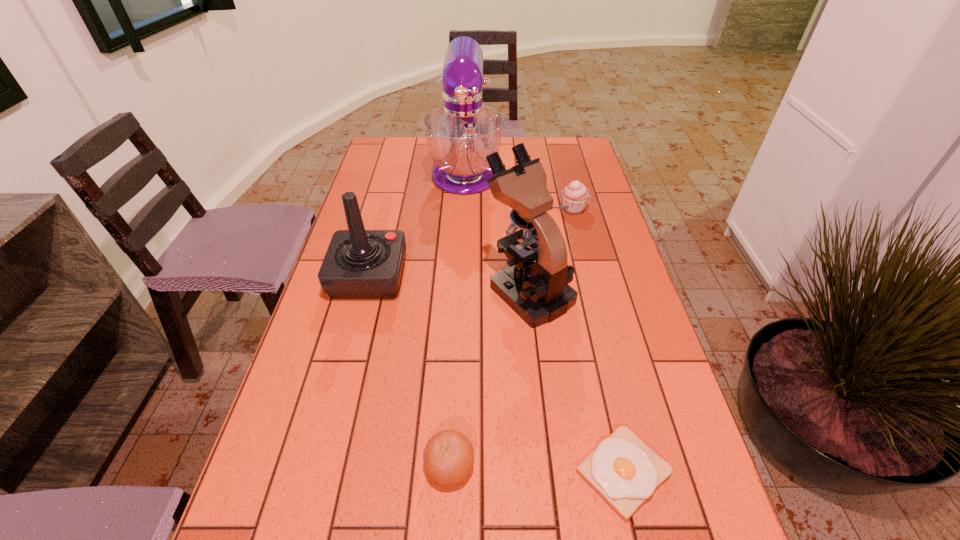
You are a GUI agent. You are given a task and a screenshot of the screen. Output one action in this format:
    pyautogui.click(x=<x>, y=<y>)
    Task: Click on the object that stands as the fourth closest to the leftmost object
    
    Given the screenshot: What is the action you would take?
    pyautogui.click(x=575, y=195)

Where is `free space that satisfies the following two spatial constraints: 1. on the back side of the shortest object; 2. on the front-facing side of the third tallest object`? free space that satisfies the following two spatial constraints: 1. on the back side of the shortest object; 2. on the front-facing side of the third tallest object is located at coordinates (578, 276).

The image size is (960, 540). I want to click on vacant area in the image that satisfies the following two spatial constraints: 1. on the back side of the second shortest object; 2. on the front-facing side of the leftmost object, so click(459, 276).

Locate an element on the screen. Image resolution: width=960 pixels, height=540 pixels. vacant point that satisfies the following two spatial constraints: 1. on the back side of the clementine; 2. on the right side of the cupcake is located at coordinates click(x=463, y=209).

Where is `vacant area in the image that satisfies the following two spatial constraints: 1. on the front side of the third shortest object; 2. on the front-facing side of the joystick`? The image size is (960, 540). vacant area in the image that satisfies the following two spatial constraints: 1. on the front side of the third shortest object; 2. on the front-facing side of the joystick is located at coordinates (590, 276).

Locate an element on the screen. Image resolution: width=960 pixels, height=540 pixels. vacant point that satisfies the following two spatial constraints: 1. at the bowl opening of the mixer; 2. on the left side of the shortest object is located at coordinates (451, 472).

This screenshot has width=960, height=540. I want to click on free space that satisfies the following two spatial constraints: 1. on the back side of the second shortest object; 2. on the right side of the third shortest object, so click(463, 209).

The width and height of the screenshot is (960, 540). I want to click on vacant area that satisfies the following two spatial constraints: 1. at the bowl opening of the cupcake; 2. on the right side of the mixer, so click(464, 209).

Find the location of a particular element. vacant space that satisfies the following two spatial constraints: 1. at the bowl opening of the mixer; 2. on the left side of the toast is located at coordinates coord(451,472).

I want to click on free space in the image that satisfies the following two spatial constraints: 1. on the front-facing side of the leftmost object; 2. on the back side of the second shortest object, so click(x=319, y=465).